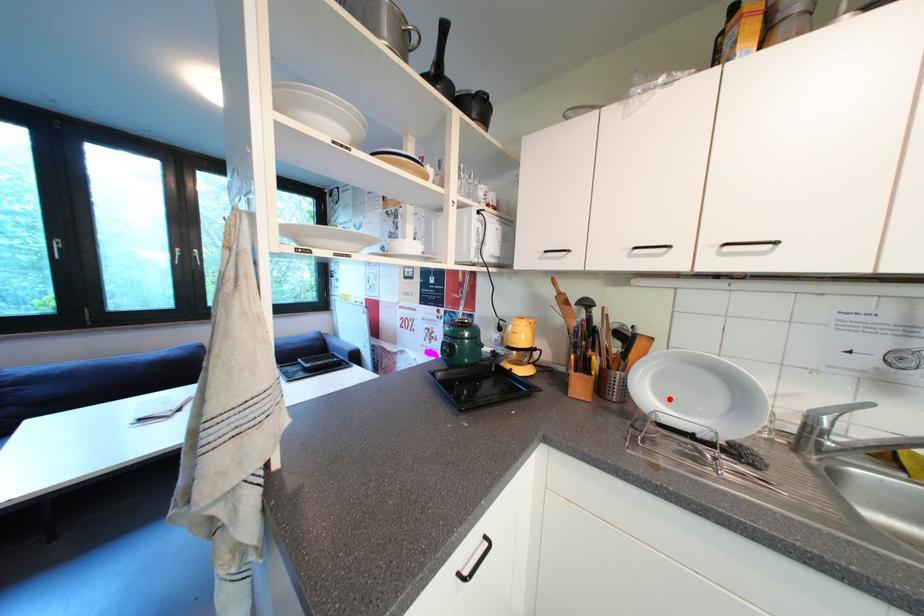
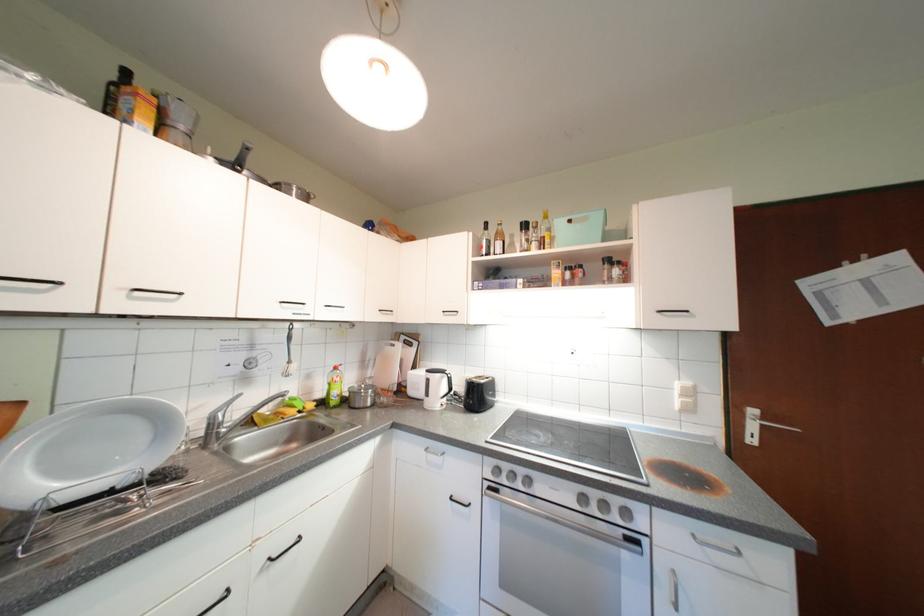
Question: I am providing you with two images of the same scene from different viewpoints. Image1 has a red point marked. In image2, the corresponding 3D location appears at what relative position? Reply with the corresponding letter.

Choices:
 (A) Closer
 (B) Farther

Answer: (A)